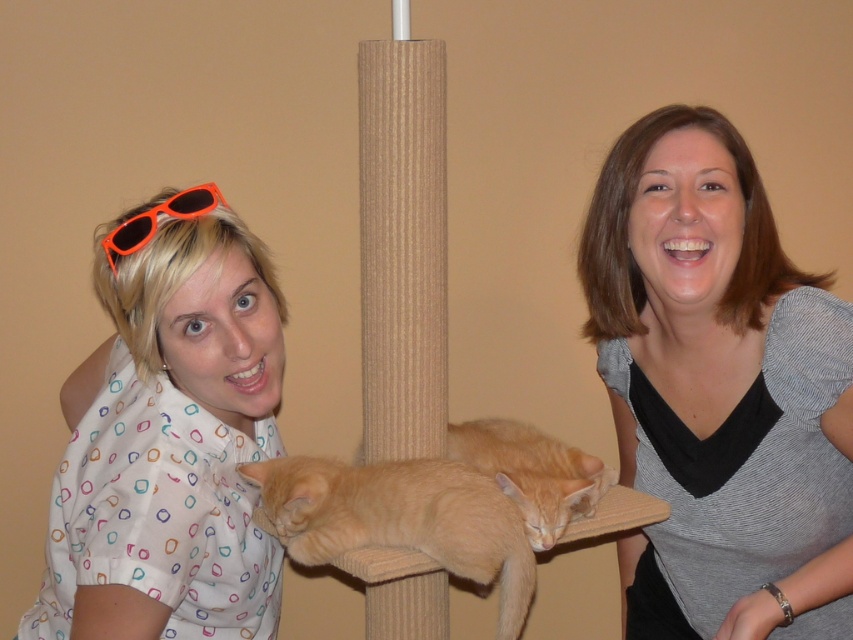
Question: Considering the relative positions of orange fur cat at center and orange plastic sunglasses at upper left in the image provided, where is orange fur cat at center located with respect to orange plastic sunglasses at upper left?

Choices:
 (A) below
 (B) above

Answer: (A)

Question: Does white dotted shirt at left have a smaller size compared to orange plastic sunglasses at upper left?

Choices:
 (A) yes
 (B) no

Answer: (B)

Question: Is gray/black fabric shirt at center to the left of orange plastic sunglasses at upper left from the viewer's perspective?

Choices:
 (A) no
 (B) yes

Answer: (A)

Question: Which point is farther to the camera?

Choices:
 (A) (397, 515)
 (B) (144, 234)

Answer: (A)

Question: Which point is closer to the camera?

Choices:
 (A) white dotted shirt at left
 (B) orange plastic sunglasses at upper left
 (C) orange fur cat at center
 (D) gray/black fabric shirt at center

Answer: (A)

Question: Which point appears farthest from the camera in this image?

Choices:
 (A) (503, 593)
 (B) (241, 582)

Answer: (A)